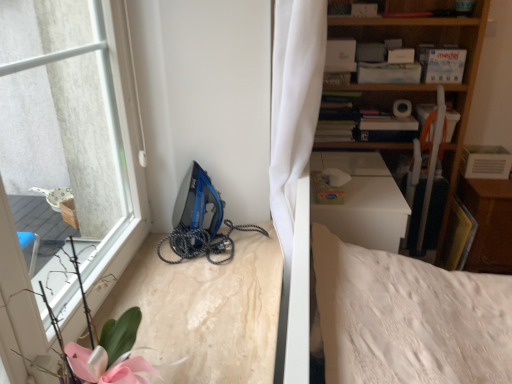
Question: Is wooden dresser at right to the left or to the right of wooden bookshelf at upper right in the image?

Choices:
 (A) left
 (B) right

Answer: (B)

Question: In terms of width, does wooden dresser at right look wider or thinner when compared to wooden bookshelf at upper right?

Choices:
 (A) thin
 (B) wide

Answer: (B)

Question: Estimate the real-world distances between objects in this image. Which object is farther from the wooden dresser at right?

Choices:
 (A) blue plastic iron at lower left
 (B) wooden bookshelf at upper right

Answer: (A)

Question: Which of these objects is positioned farthest from the wooden dresser at right?

Choices:
 (A) wooden bookshelf at upper right
 (B) blue plastic iron at lower left

Answer: (B)